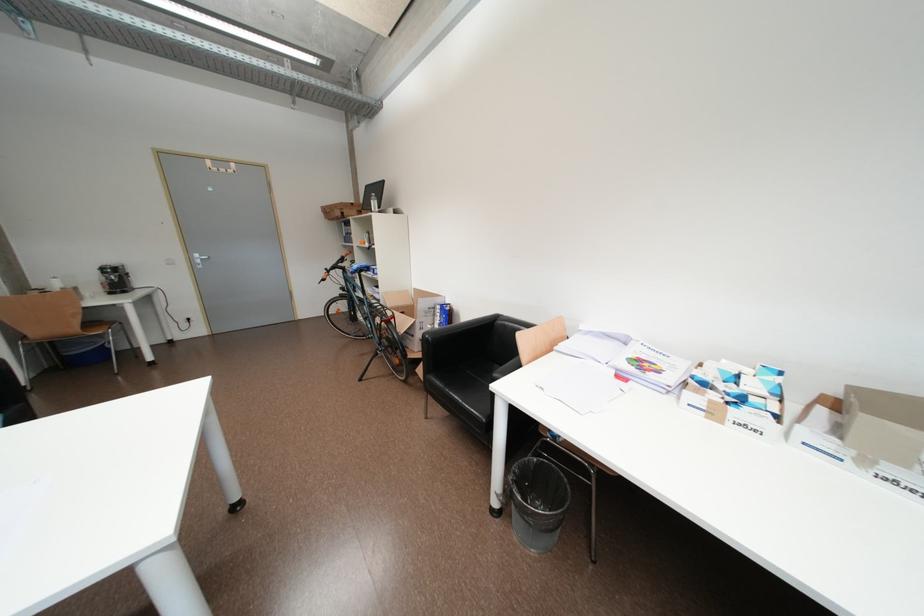
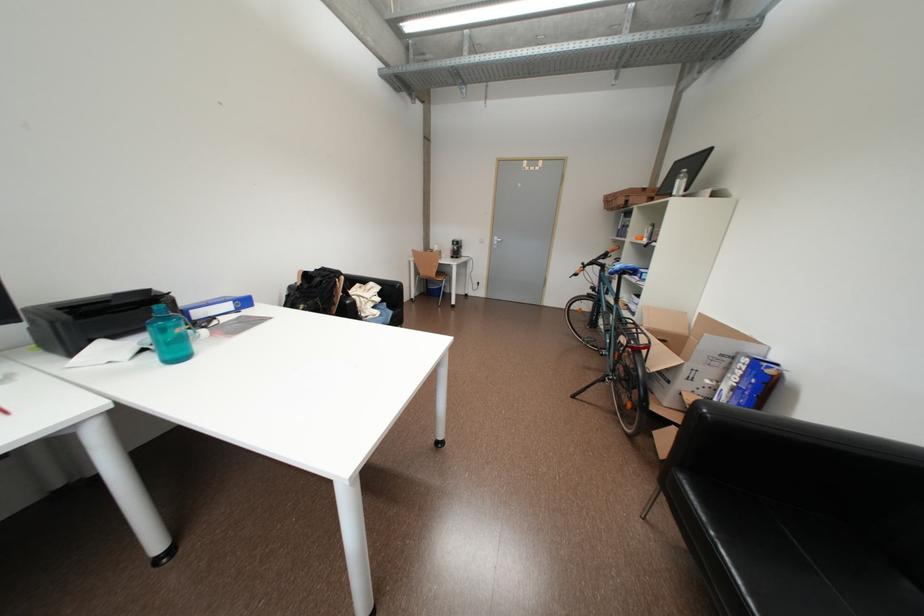
The point at (432, 338) is marked in the first image. Where is the corresponding point in the second image?

(704, 406)